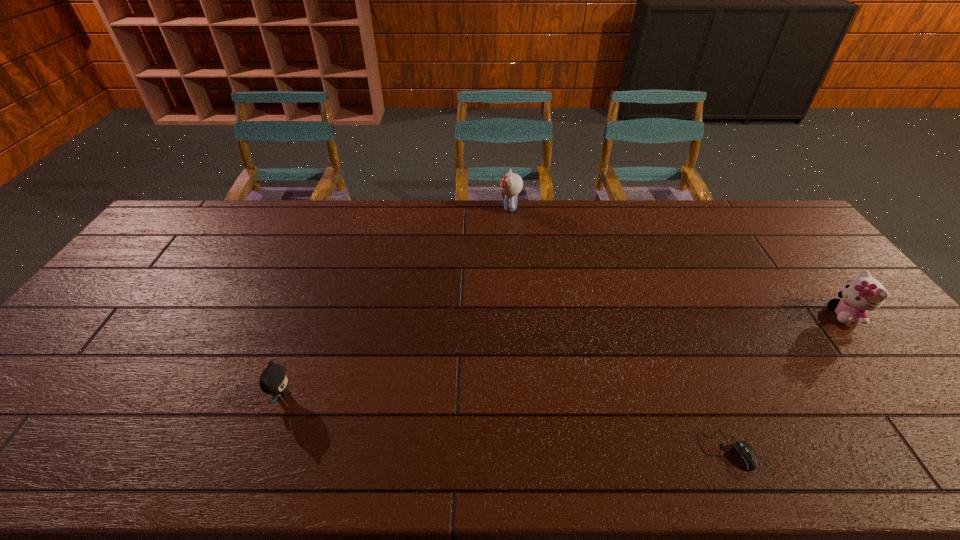
Locate an element on the screen. vacant space at the left edge of the desktop is located at coordinates (52, 404).

Where is `free space at the right edge of the desktop`? free space at the right edge of the desktop is located at coordinates (812, 262).

In the image, there is a desktop. At what (x,y) coordinates should I click in order to perform the action: click on vacant region at the far left corner. Please return your answer as a coordinate pair (x, y). This screenshot has width=960, height=540. Looking at the image, I should click on (209, 221).

The width and height of the screenshot is (960, 540). In order to click on free space between the farthest kitten and the nearest kitten in this screenshot , I will do `click(396, 301)`.

This screenshot has width=960, height=540. I want to click on unoccupied area between the nearest kitten and the shortest object, so click(x=504, y=423).

I want to click on free space that is in between the rightmost object and the farthest kitten, so click(x=678, y=261).

I want to click on vacant area that lies between the rightmost object and the third object from right to left, so 678,261.

Image resolution: width=960 pixels, height=540 pixels. Identify the location of vacant space that's between the shortest object and the shortest kitten. (504, 423).

The width and height of the screenshot is (960, 540). In order to click on free spot between the third nearest object and the nearest object in this screenshot , I will do `click(785, 382)`.

I want to click on vacant space that's between the computer mouse and the farthest kitten, so click(617, 329).